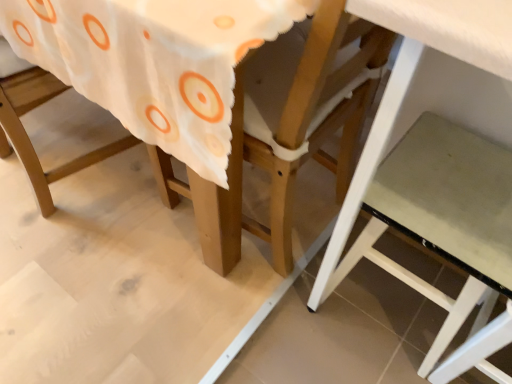
Question: From a real-world perspective, is white matte step stool at lower right above or below wooden chair at center?

Choices:
 (A) above
 (B) below

Answer: (B)

Question: Is white matte step stool at lower right situated inside wooden chair at center or outside?

Choices:
 (A) inside
 (B) outside

Answer: (B)

Question: Considering their positions, is white matte step stool at lower right located in front of or behind wooden chair at center?

Choices:
 (A) front
 (B) behind

Answer: (B)

Question: From a real-world perspective, is wooden chair at center positioned above or below white matte step stool at lower right?

Choices:
 (A) below
 (B) above

Answer: (B)

Question: From the image's perspective, relative to white matte step stool at lower right, is wooden chair at center above or below?

Choices:
 (A) below
 (B) above

Answer: (B)

Question: Is wooden chair at center inside the boundaries of white matte step stool at lower right, or outside?

Choices:
 (A) inside
 (B) outside

Answer: (B)

Question: From their relative heights in the image, would you say wooden chair at center is taller or shorter than white matte step stool at lower right?

Choices:
 (A) short
 (B) tall

Answer: (B)